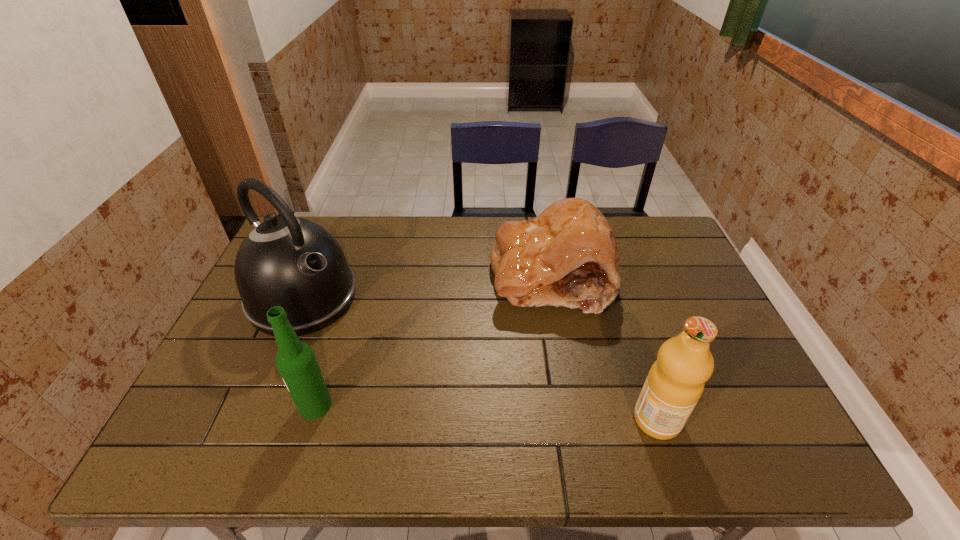
Identify the location of free spot between the beer bottle and the fruit juice. The image size is (960, 540). 486,413.

Select which object appears as the closest to the shortest object. Please provide its 2D coordinates. Your answer should be formatted as a tuple, i.e. [(x, y)], where the tuple contains the x and y coordinates of a point satisfying the conditions above.

[(675, 382)]

What are the coordinates of `object that is the closest to the fruit juice` in the screenshot? It's located at (567, 256).

Find the location of `vacant space that satisfies the following two spatial constraints: 1. on the front side of the shortest object; 2. on the front label of the fruit juice`. vacant space that satisfies the following two spatial constraints: 1. on the front side of the shortest object; 2. on the front label of the fruit juice is located at coordinates (576, 420).

This screenshot has width=960, height=540. In order to click on free space that satisfies the following two spatial constraints: 1. on the front side of the kettle; 2. on the front label of the fruit juice in this screenshot , I will do `click(252, 420)`.

Identify the location of free space in the image that satisfies the following two spatial constraints: 1. on the front side of the tallest object; 2. on the front label of the fruit juice. The height and width of the screenshot is (540, 960). (252, 420).

Where is `vacant region that satisfies the following two spatial constraints: 1. on the front side of the fruit juice; 2. on the front label of the shortest object`? vacant region that satisfies the following two spatial constraints: 1. on the front side of the fruit juice; 2. on the front label of the shortest object is located at coordinates (576, 420).